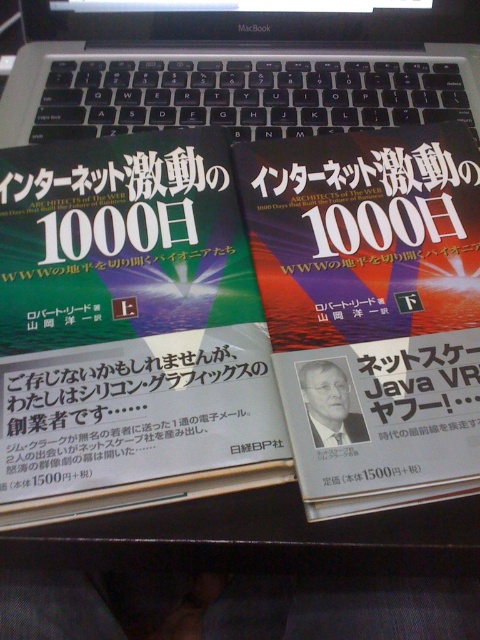
Question: Does matte hardcover book at center appear on the left side of matte paper book at center?

Choices:
 (A) yes
 (B) no

Answer: (A)

Question: Among these points, which one is farthest from the camera?

Choices:
 (A) (327, 460)
 (B) (108, 60)

Answer: (B)

Question: Is matte hardcover book at center thinner than matte paper book at center?

Choices:
 (A) yes
 (B) no

Answer: (B)

Question: Which object is farther from the camera taking this photo?

Choices:
 (A) black plastic keyboard at upper center
 (B) matte paper book at center
 (C) matte hardcover book at center

Answer: (A)

Question: Does matte hardcover book at center have a lesser width compared to black plastic keyboard at upper center?

Choices:
 (A) yes
 (B) no

Answer: (A)

Question: Among these points, which one is nearest to the camera?

Choices:
 (A) (250, 209)
 (B) (231, 436)
 (C) (269, 106)

Answer: (B)